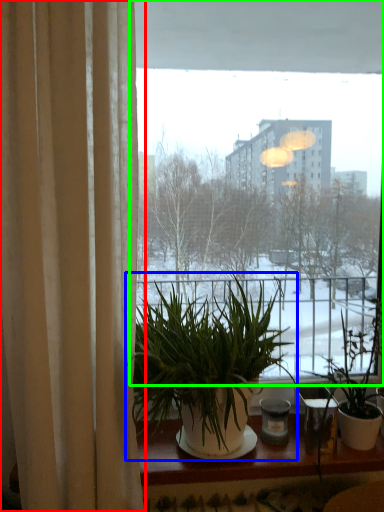
Question: Based on their relative distances, which object is nearer to curtain (highlighted by a red box)? Choose from houseplant (highlighted by a blue box) and window (highlighted by a green box).

Choices:
 (A) houseplant
 (B) window

Answer: (A)